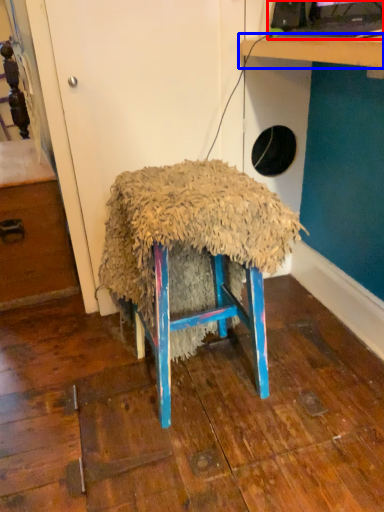
Question: Among these objects, which one is farthest to the camera, desktop computer (highlighted by a red box) or table (highlighted by a blue box)?

Choices:
 (A) desktop computer
 (B) table

Answer: (A)